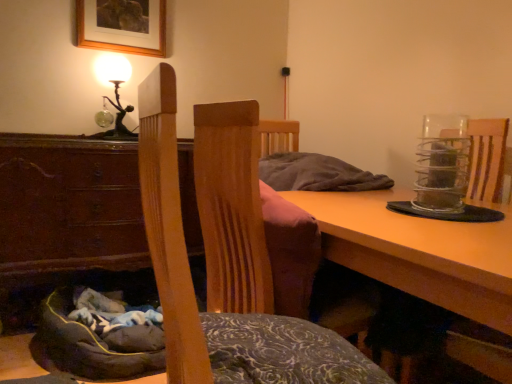
Question: Is wooden picture frame at upper center wider than dark gray fabric bean bag at lower left?

Choices:
 (A) no
 (B) yes

Answer: (A)

Question: From a real-world perspective, is wooden picture frame at upper center on top of dark gray fabric bean bag at lower left?

Choices:
 (A) yes
 (B) no

Answer: (A)

Question: From the image's perspective, does wooden picture frame at upper center appear lower than dark gray fabric bean bag at lower left?

Choices:
 (A) yes
 (B) no

Answer: (B)

Question: Is wooden picture frame at upper center aimed at dark gray fabric bean bag at lower left?

Choices:
 (A) yes
 (B) no

Answer: (B)

Question: Does wooden picture frame at upper center contain dark gray fabric bean bag at lower left?

Choices:
 (A) no
 (B) yes

Answer: (A)

Question: Is wooden picture frame at upper center located outside dark gray fabric bean bag at lower left?

Choices:
 (A) yes
 (B) no

Answer: (A)

Question: Is wooden picture frame at upper center facing towards metallic glass table lamp at upper left?

Choices:
 (A) no
 (B) yes

Answer: (A)

Question: From the image's perspective, is wooden picture frame at upper center located beneath metallic glass table lamp at upper left?

Choices:
 (A) yes
 (B) no

Answer: (B)

Question: Considering the relative sizes of wooden picture frame at upper center and metallic glass table lamp at upper left in the image provided, is wooden picture frame at upper center shorter than metallic glass table lamp at upper left?

Choices:
 (A) no
 (B) yes

Answer: (B)

Question: Is wooden picture frame at upper center facing away from metallic glass table lamp at upper left?

Choices:
 (A) no
 (B) yes

Answer: (A)

Question: Is wooden picture frame at upper center behind metallic glass table lamp at upper left?

Choices:
 (A) no
 (B) yes

Answer: (B)

Question: Is wooden picture frame at upper center thinner than metallic glass table lamp at upper left?

Choices:
 (A) no
 (B) yes

Answer: (B)

Question: Does dark gray fabric bean bag at lower left have a lesser width compared to brown wood cabinet at lower left?

Choices:
 (A) yes
 (B) no

Answer: (B)